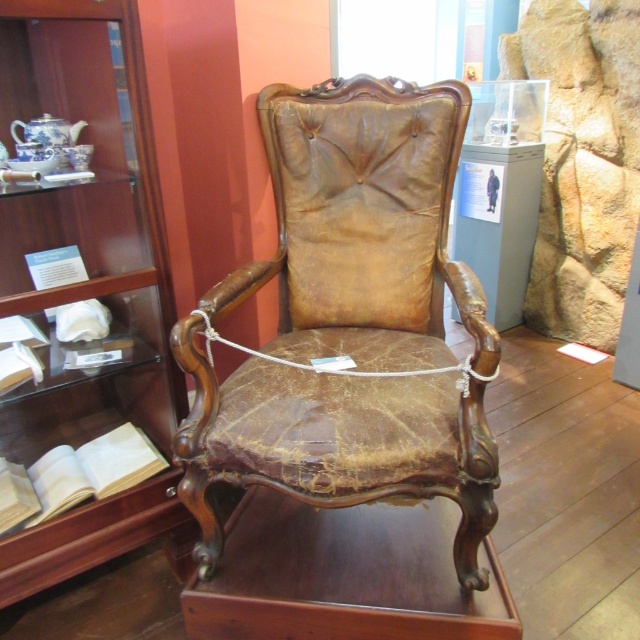
Question: Is wooden bookshelf at center to the left of light brown paper book at lower left from the viewer's perspective?

Choices:
 (A) yes
 (B) no

Answer: (A)

Question: Which object appears farthest from the camera in this image?

Choices:
 (A) wooden bookshelf at center
 (B) light brown paper book at lower left

Answer: (B)

Question: Which of the following is the closest to the observer?

Choices:
 (A) light brown paper book at lower left
 (B) wooden bookshelf at center

Answer: (B)

Question: Is wooden bookshelf at center further to the viewer compared to light brown paper book at lower left?

Choices:
 (A) no
 (B) yes

Answer: (A)

Question: Is wooden bookshelf at center thinner than light brown paper book at lower left?

Choices:
 (A) no
 (B) yes

Answer: (A)